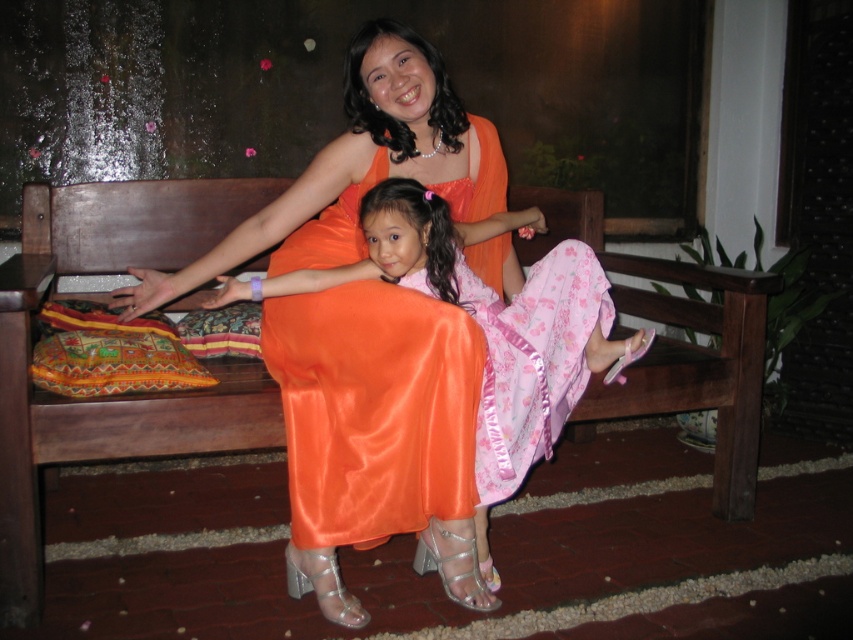
Question: Among these points, which one is nearest to the camera?

Choices:
 (A) (451, 508)
 (B) (122, 230)

Answer: (A)

Question: In this image, where is wooden bench at center located relative to shiny orange dress at center?

Choices:
 (A) left
 (B) right

Answer: (A)

Question: Can you confirm if wooden bench at center is positioned to the left of shiny orange dress at center?

Choices:
 (A) no
 (B) yes

Answer: (B)

Question: Is wooden bench at center wider than shiny orange dress at center?

Choices:
 (A) yes
 (B) no

Answer: (A)